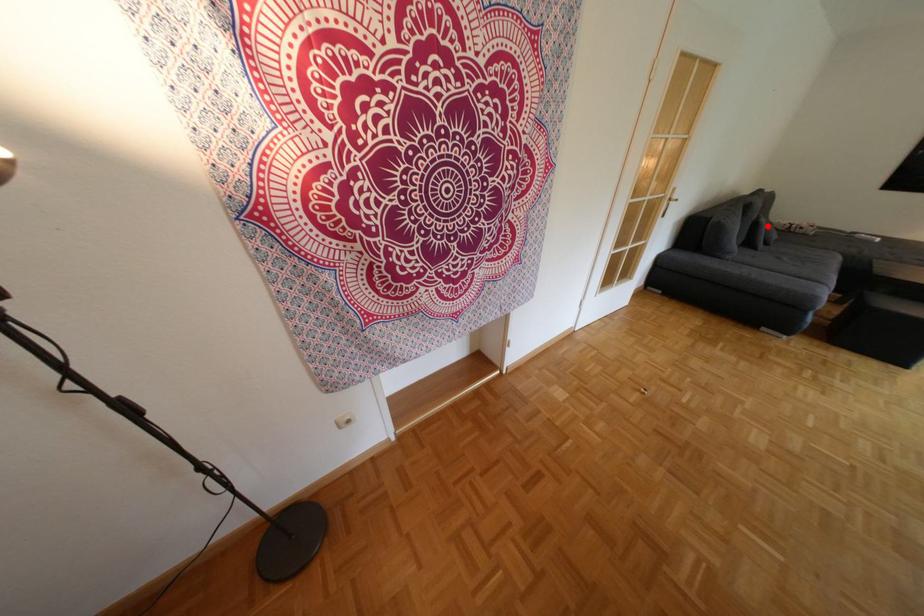
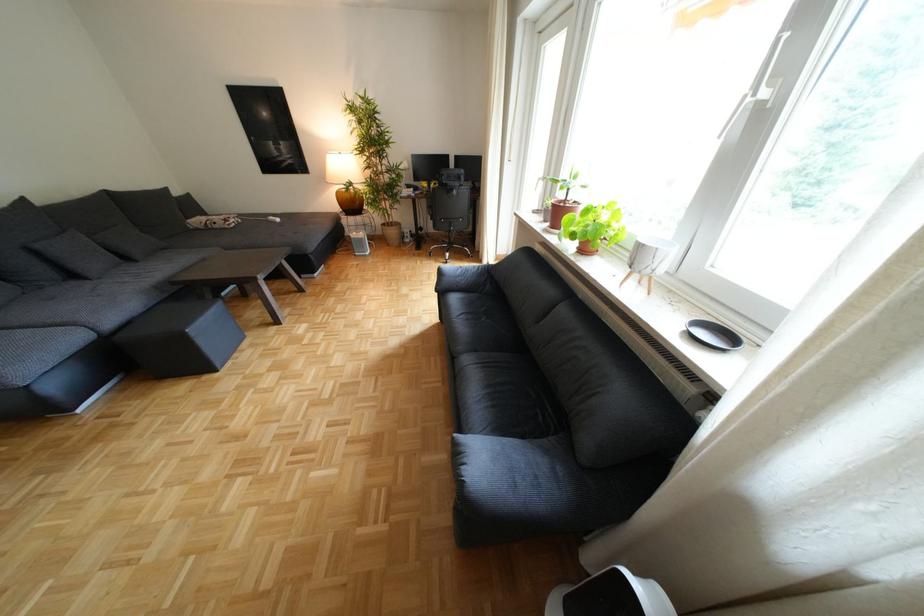
In the second image, find the point that corresponds to the highlighted location in the first image.

(49, 253)